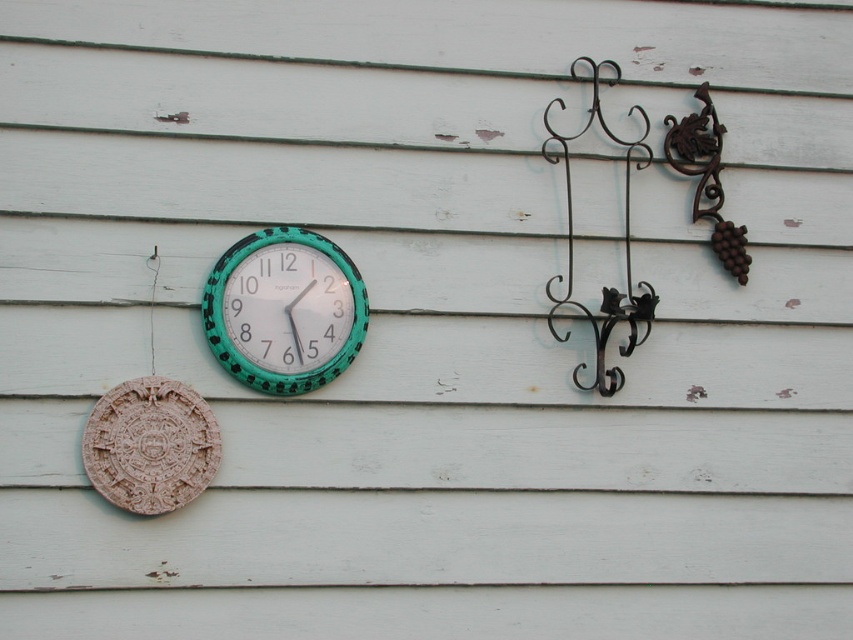
The image size is (853, 640). What do you see at coordinates (283, 310) in the screenshot? I see `teal painted metal clock at center` at bounding box center [283, 310].

Which of these two, teal painted metal clock at center or rusty wrought iron hook at upper right, stands shorter?

teal painted metal clock at center

Is point (254, 316) less distant than point (668, 124)?

Yes, point (254, 316) is in front of point (668, 124).

I want to click on teal painted metal clock at center, so click(x=283, y=310).

What do you see at coordinates (624, 243) in the screenshot? I see `black wrought iron hook at upper right` at bounding box center [624, 243].

Which is below, black wrought iron hook at upper right or rusty wrought iron hook at upper right?

Positioned lower is black wrought iron hook at upper right.

Describe the element at coordinates (624, 243) in the screenshot. The height and width of the screenshot is (640, 853). I see `black wrought iron hook at upper right` at that location.

Identify the location of black wrought iron hook at upper right. (624, 243).

Which is more to the left, teal painted metal clock at center or black wrought iron hook at upper right?

teal painted metal clock at center

Can you confirm if teal painted metal clock at center is positioned to the right of black wrought iron hook at upper right?

Incorrect, teal painted metal clock at center is not on the right side of black wrought iron hook at upper right.

Is point (317, 259) farther from camera compared to point (635, 317)?

No, it is in front of (635, 317).

What are the coordinates of `teal painted metal clock at center` in the screenshot? It's located at (283, 310).